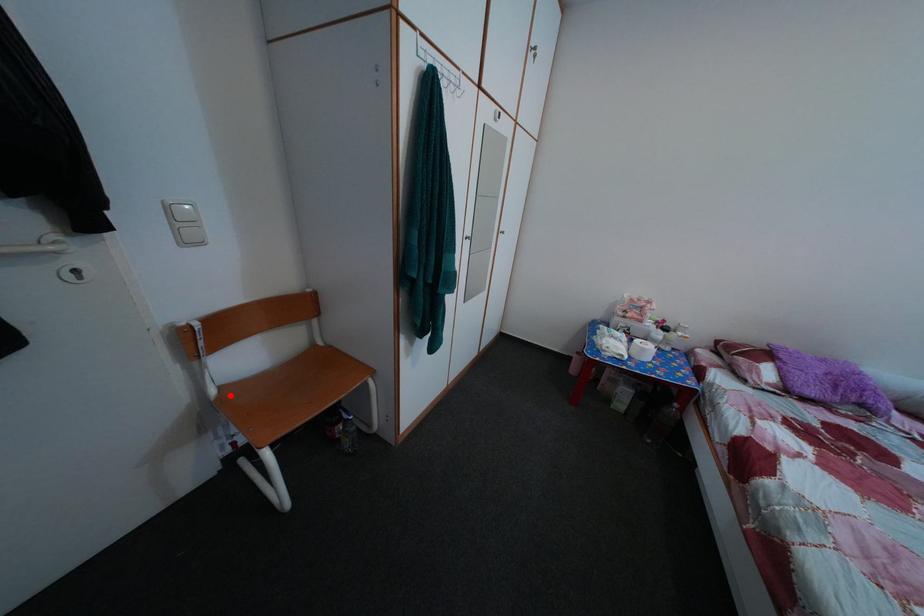
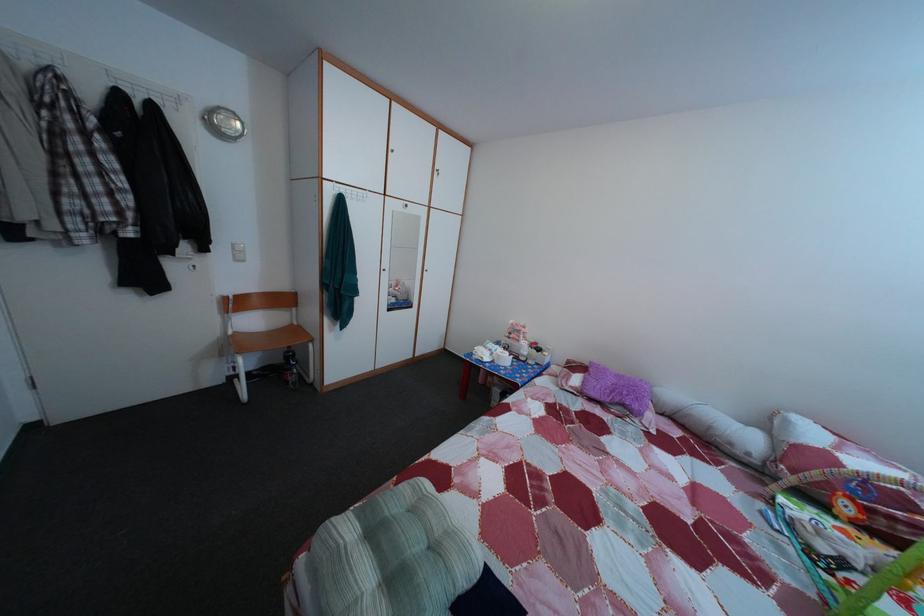
Find the pixel in the second image that matches the highlighted location in the first image.

(245, 339)